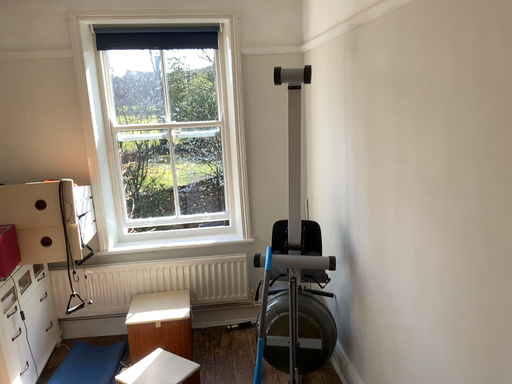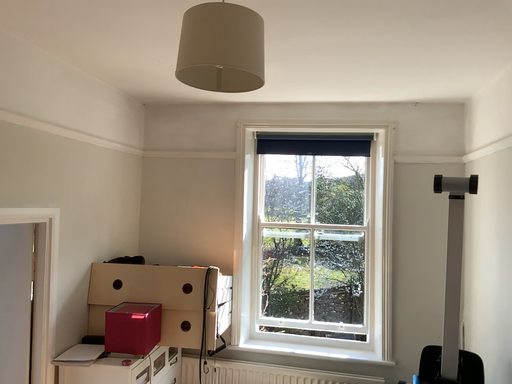
Question: How did the camera likely rotate when shooting the video?

Choices:
 (A) rotated upward
 (B) rotated downward

Answer: (A)